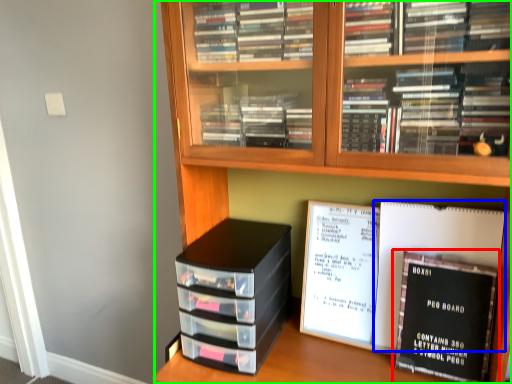
Question: Estimate the real-world distances between objects in this image. Which object is farther from book (highlighted by a red box), journal (highlighted by a blue box) or bookcase (highlighted by a green box)?

Choices:
 (A) journal
 (B) bookcase

Answer: (B)